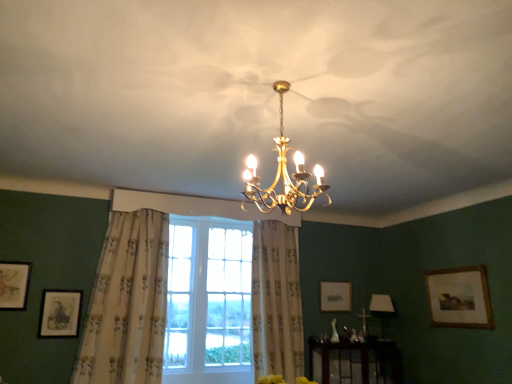
Question: From the image's perspective, is gold metallic chandelier at center, which ranks as the 1th lamp in left-to-right order, below white floral fabric curtain at left, arranged as the 2th curtain when viewed from the right?

Choices:
 (A) no
 (B) yes

Answer: (A)

Question: Can you confirm if gold metallic chandelier at center, the second lamp positioned from the right, is positioned to the left of white floral fabric curtain at left, arranged as the 2th curtain when viewed from the right?

Choices:
 (A) yes
 (B) no

Answer: (B)

Question: Can you confirm if gold metallic chandelier at center, which is the 1th lamp from top to bottom, is positioned to the right of white floral fabric curtain at left, arranged as the 1th curtain when viewed from the left?

Choices:
 (A) yes
 (B) no

Answer: (A)

Question: Is gold metallic chandelier at center, acting as the second lamp starting from the bottom, shorter than white floral fabric curtain at left, arranged as the 2th curtain when viewed from the right?

Choices:
 (A) yes
 (B) no

Answer: (A)

Question: From a real-world perspective, is gold metallic chandelier at center, the 1th lamp from the front, positioned over white floral fabric curtain at left, arranged as the 1th curtain when viewed from the left, based on gravity?

Choices:
 (A) no
 (B) yes

Answer: (B)

Question: Considering the relative sizes of gold metallic chandelier at center, the second lamp positioned from the right, and white floral fabric curtain at left, arranged as the 2th curtain when viewed from the right, in the image provided, is gold metallic chandelier at center, the second lamp positioned from the right, smaller than white floral fabric curtain at left, arranged as the 2th curtain when viewed from the right,?

Choices:
 (A) yes
 (B) no

Answer: (A)

Question: Does beige floral fabric curtain at center, which ranks as the first curtain in right-to-left order, have a greater height compared to gold metallic chandelier at center, acting as the second lamp starting from the bottom?

Choices:
 (A) yes
 (B) no

Answer: (A)

Question: Does beige floral fabric curtain at center, the 2th curtain positioned from the left, turn towards gold metallic chandelier at center, which ranks as the 1th lamp in left-to-right order?

Choices:
 (A) no
 (B) yes

Answer: (A)

Question: Does beige floral fabric curtain at center, which ranks as the first curtain in right-to-left order, touch gold metallic chandelier at center, the second lamp positioned from the right?

Choices:
 (A) yes
 (B) no

Answer: (B)

Question: Can we say beige floral fabric curtain at center, which ranks as the first curtain in right-to-left order, lies outside gold metallic chandelier at center, the 1th lamp from the front?

Choices:
 (A) no
 (B) yes

Answer: (B)

Question: From a real-world perspective, is beige floral fabric curtain at center, which ranks as the first curtain in right-to-left order, physically above gold metallic chandelier at center, the second lamp positioned from the right?

Choices:
 (A) yes
 (B) no

Answer: (B)

Question: Is gold metallic chandelier at center, acting as the second lamp starting from the bottom, at the back of beige floral fabric curtain at center, the 2th curtain positioned from the left?

Choices:
 (A) yes
 (B) no

Answer: (B)

Question: From the image's perspective, is matte gold picture frame at lower left, which is the 2th picture frame in front-to-back order, on top of wooden framed painting at right, which appears as the first picture frame when viewed from the right?

Choices:
 (A) no
 (B) yes

Answer: (A)